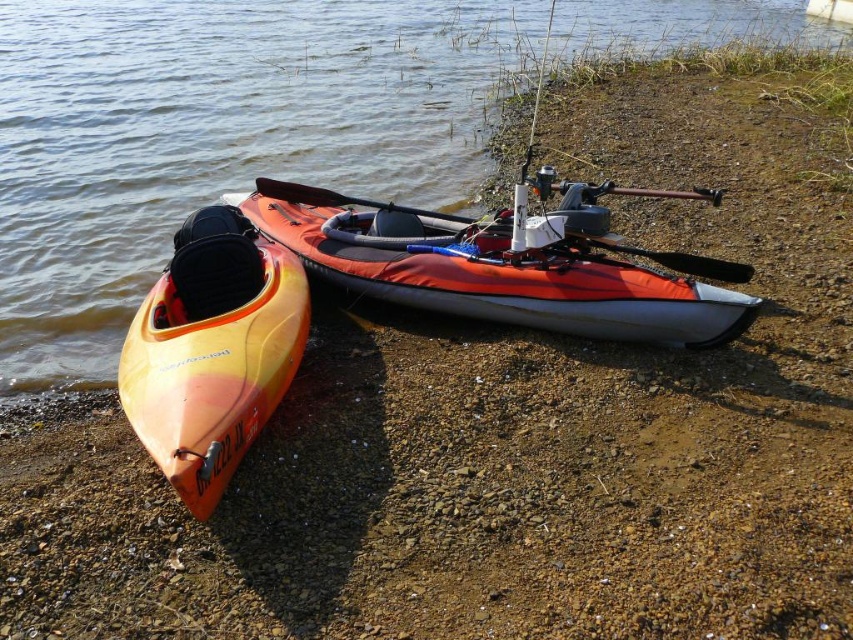
You are standing on the rocky shoreline next to the two kayaks. You need to reach a point marked at coordinates (x=668, y=253). If your maximum reach is 15 feet, can you touch that point without moving closer?

The point at coordinates (x=668, y=253) is 15.97 feet away from the viewer. Since your maximum reach is 15 feet, you cannot touch it without moving closer.